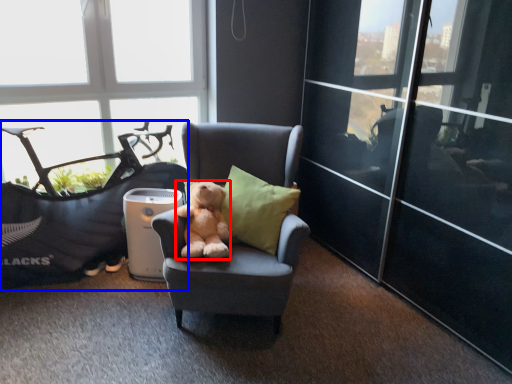
Question: Among these objects, which one is farthest to the camera, teddy bear (highlighted by a red box) or bean bag chair (highlighted by a blue box)?

Choices:
 (A) teddy bear
 (B) bean bag chair

Answer: (B)